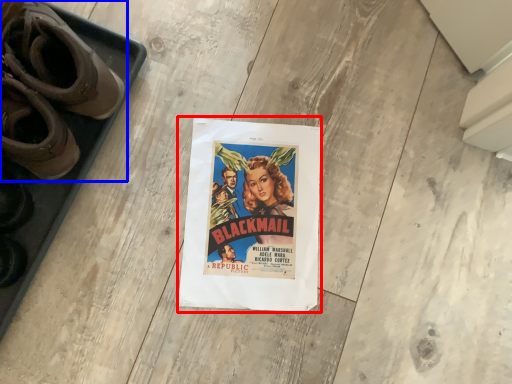
Question: Which point is further to the camera, poster (highlighted by a red box) or footwear (highlighted by a blue box)?

Choices:
 (A) poster
 (B) footwear

Answer: (A)